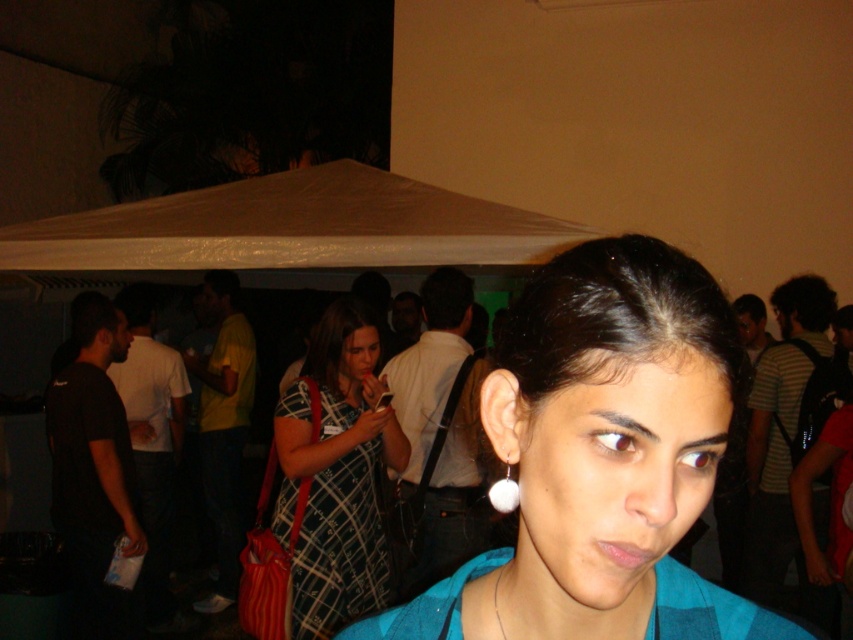
You are planning to wear the plaid fabric dress at center and the white pearl earring at center to an event. Based on the image description, which item is wider?

The plaid fabric dress at center is wider than the white pearl earring at center according to the description.

You are at the event and want to reach a specific location marked by the point at coordinates [711,451]. If your reach extends 18 inches, can you touch that point without moving closer?

The point at coordinates [711,451] is 17.57 inches away from the viewer, so yes, you can touch it with your 18 inch reach without moving closer.